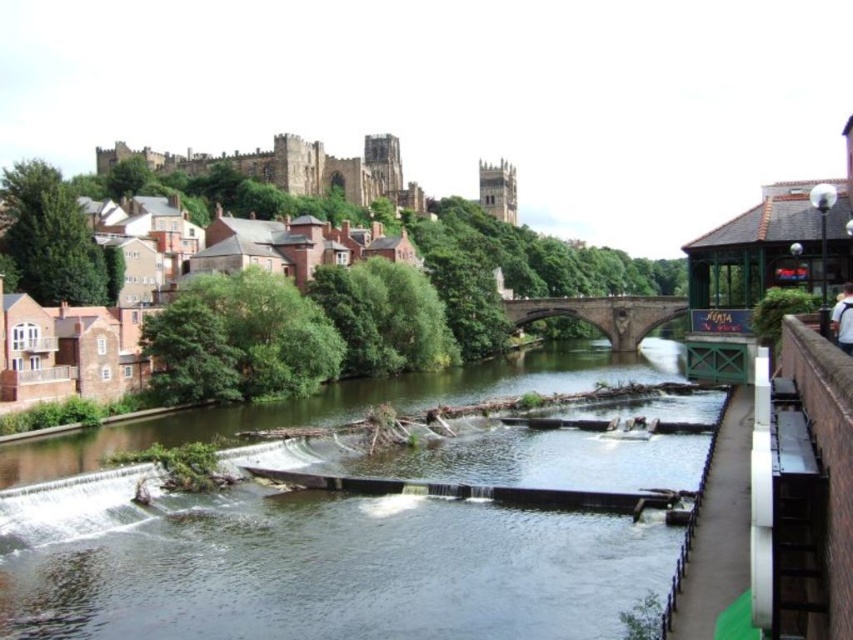
Between brown stone castle at upper left and brown stone bridge at center, which one appears on the right side from the viewer's perspective?

brown stone bridge at center

Is brown stone castle at upper left below brown stone bridge at center?

Incorrect, brown stone castle at upper left is not positioned below brown stone bridge at center.

Find the location of `brown stone castle at upper left`. brown stone castle at upper left is located at coordinates (294, 168).

How far apart are smooth concrete river at center and brown stone bridge at center?

smooth concrete river at center and brown stone bridge at center are 62.91 meters apart from each other.

From the picture: Can you confirm if smooth concrete river at center is smaller than brown stone bridge at center?

Incorrect, smooth concrete river at center is not smaller in size than brown stone bridge at center.

Which is behind, point (419, 378) or point (630, 332)?

Point (630, 332)

Locate an element on the screen. smooth concrete river at center is located at coordinates (318, 570).

Between smooth concrete river at center and brown brick houses at upper left, which one is positioned higher?

brown brick houses at upper left is higher up.

This screenshot has width=853, height=640. What do you see at coordinates (318, 570) in the screenshot?
I see `smooth concrete river at center` at bounding box center [318, 570].

You are a GUI agent. You are given a task and a screenshot of the screen. Output one action in this format:
    pyautogui.click(x=<x>, y=<y>)
    Task: Click on the smooth concrete river at center
    
    Given the screenshot: What is the action you would take?
    pyautogui.click(x=318, y=570)